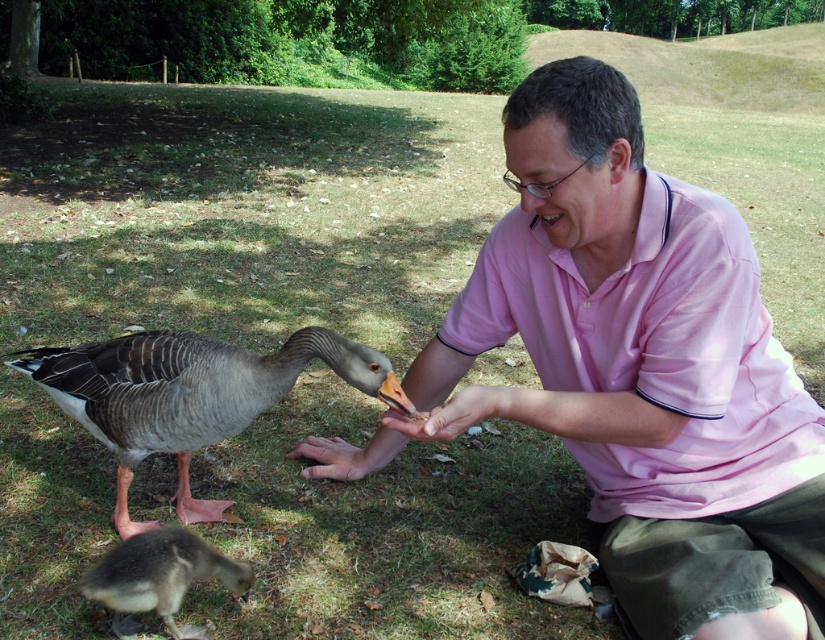
What are the coordinates of the gray feathered duck at center?

The gray feathered duck at center is located at coordinates point (187, 396).

You are a photographer trying to capture the man feeding the goose. You notice the pink cotton polo shirt at center and the matte skin hand at center. Which object should you focus on first if you want to ensure the foreground is sharp?

The pink cotton polo shirt at center is in front of the matte skin hand at center, so you should focus on the pink cotton polo shirt at center first to ensure the foreground is sharp.

What are the coordinates of the pink cotton polo shirt at center in the image?

The coordinates of the pink cotton polo shirt at center are at point (654, 353).